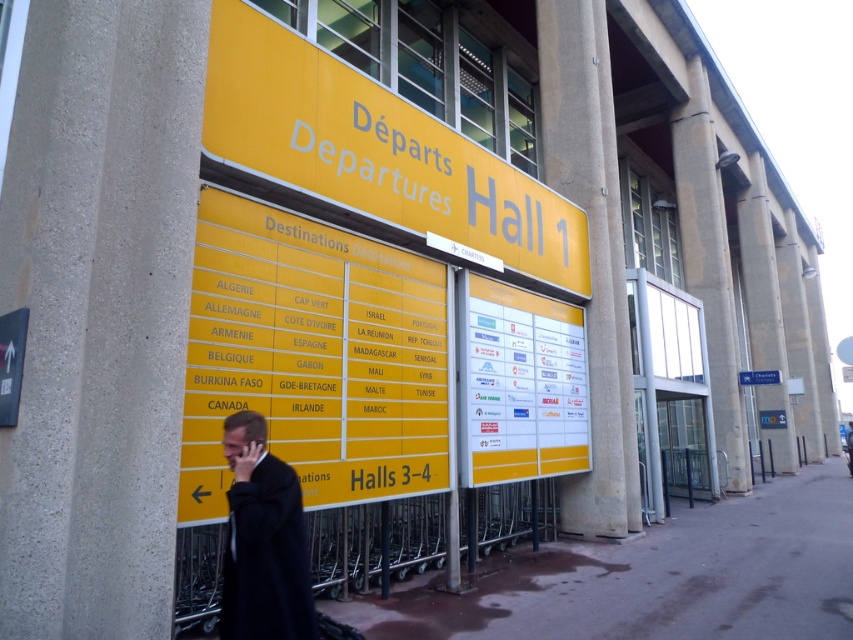
You are a traveler standing at the airport terminal and need to walk to the yellow matte sign at upper center. The dark gray asphalt at lower center is the path you must take. Is the path wide enough for two people to walk side by side comfortably?

The dark gray asphalt at lower center is wider than the yellow matte sign at upper center. Since the asphalt path is wider, it should be sufficient for two people to walk side by side comfortably.

You are a maintenance worker needing to reach the camera located near the Departures Hall 1 sign. You have a ladder that is 5 meters long. Can you safely reach the camera from the dark gray asphalt at lower center?

The dark gray asphalt at lower center and camera are 5.08 meters apart from each other. Since the ladder is 5 meters long, it is 8 centimeters shorter than the required distance. Therefore, the ladder is not long enough to safely reach the camera from the dark gray asphalt at lower center.